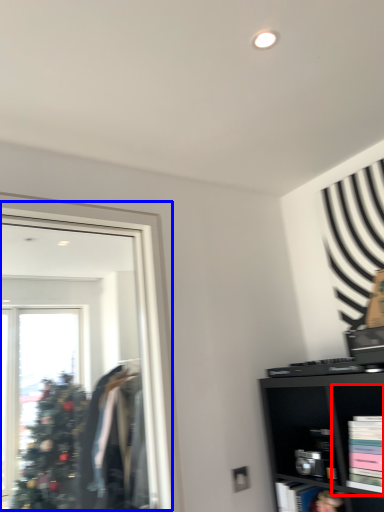
Question: Which object appears farthest to the camera in this image, cabinet (highlighted by a red box) or mirror (highlighted by a blue box)?

Choices:
 (A) cabinet
 (B) mirror

Answer: (A)